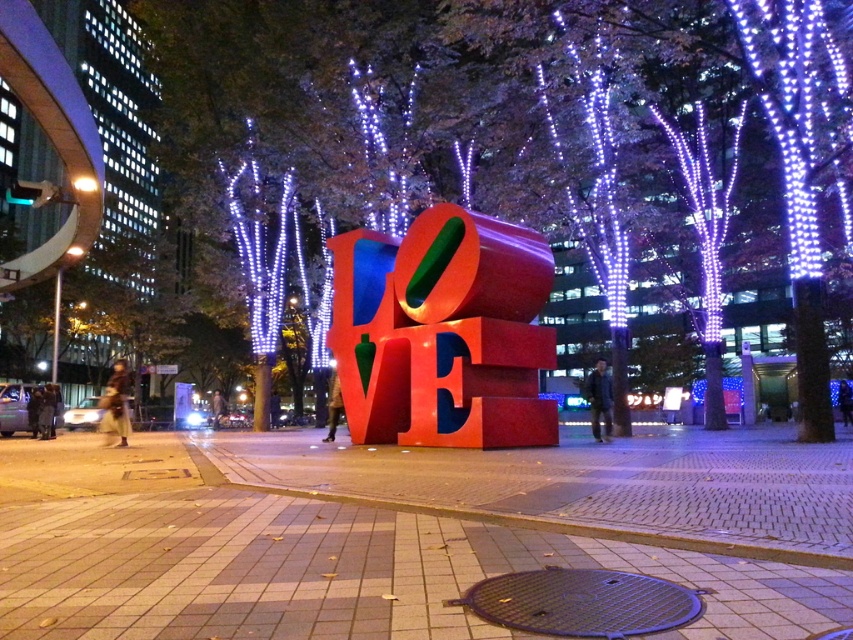
Question: Which object is positioned farthest from the brick pavement at center?

Choices:
 (A) metallic brown manhole cover at lower center
 (B) orange matte sculpture at center

Answer: (B)

Question: Is brick pavement at center in front of orange matte sculpture at center?

Choices:
 (A) no
 (B) yes

Answer: (B)

Question: Which point is farther to the camera?

Choices:
 (A) orange matte sculpture at center
 (B) brick pavement at center
 (C) metallic brown manhole cover at lower center

Answer: (A)

Question: Can you confirm if orange matte sculpture at center is positioned below metallic brown manhole cover at lower center?

Choices:
 (A) yes
 (B) no

Answer: (B)

Question: Does brick pavement at center appear on the right side of metallic brown manhole cover at lower center?

Choices:
 (A) yes
 (B) no

Answer: (B)

Question: Which point is closer to the camera taking this photo?

Choices:
 (A) (595, 605)
 (B) (222, 620)
 (C) (469, 408)

Answer: (B)